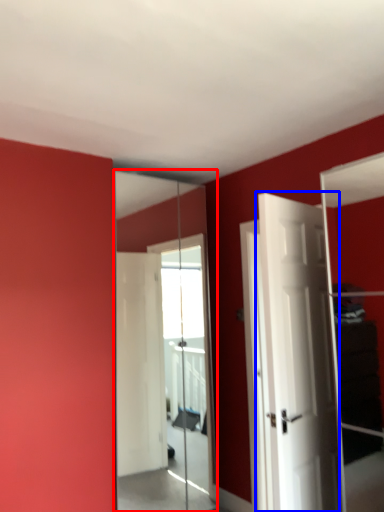
Question: Which object is further to the camera taking this photo, mirror (highlighted by a red box) or door (highlighted by a blue box)?

Choices:
 (A) mirror
 (B) door

Answer: (A)